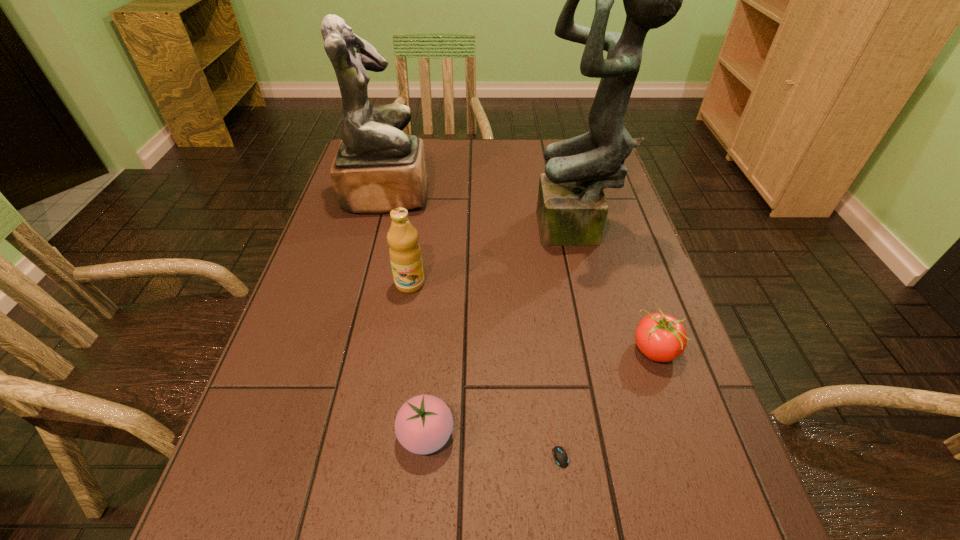
At what (x,y) coordinates should I click in order to perform the action: click on the tallest object. Please return your answer as a coordinate pair (x, y). This screenshot has height=540, width=960. Looking at the image, I should click on (572, 209).

The image size is (960, 540). What are the coordinates of `the right sculpture` in the screenshot? It's located at (572, 209).

Identify the location of the left sculpture. pos(377,168).

Identify the location of the shorter sculpture. This screenshot has height=540, width=960. (377, 168).

I want to click on the third tallest object, so click(x=405, y=254).

Where is `the fourth nearest object`? Image resolution: width=960 pixels, height=540 pixels. the fourth nearest object is located at coordinates (405, 254).

Identify the location of the right tomato. The image size is (960, 540). (660, 337).

Find the location of a particular element. Image resolution: width=960 pixels, height=540 pixels. the third nearest object is located at coordinates (660, 337).

At what (x,y) coordinates should I click in order to perform the action: click on the left tomato. Please return your answer as a coordinate pair (x, y). The height and width of the screenshot is (540, 960). Looking at the image, I should click on (423, 425).

Locate an element on the screen. the shortest object is located at coordinates (560, 456).